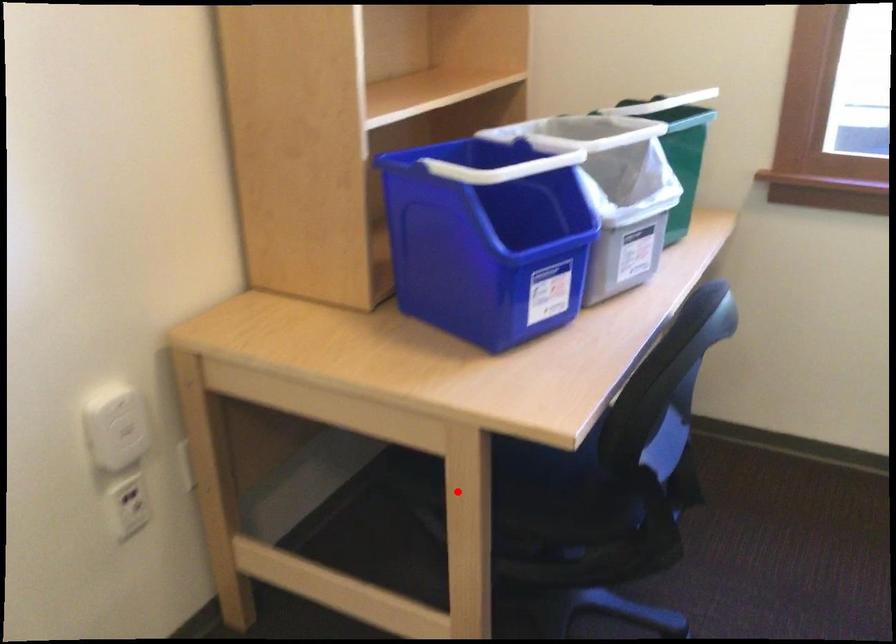
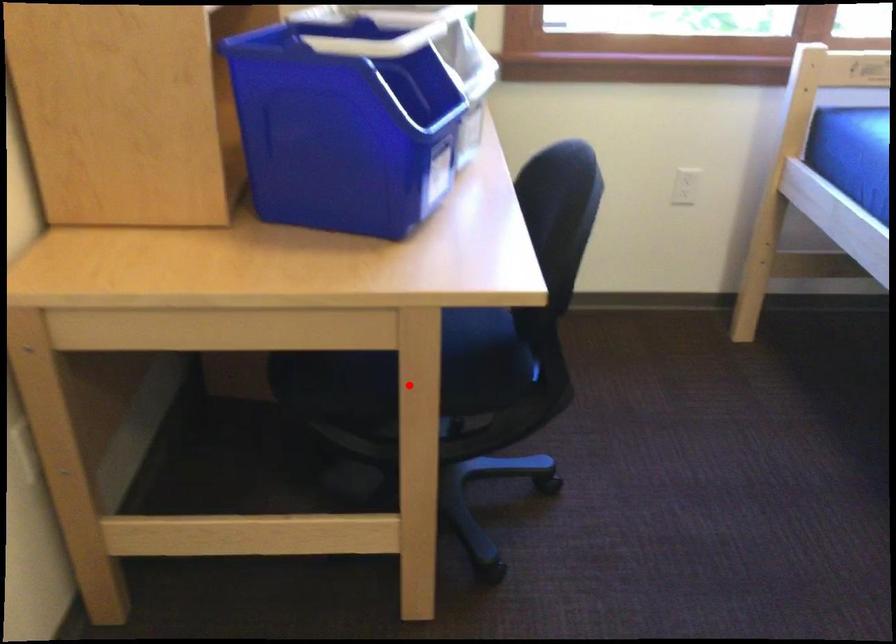
I am providing you with two images of the same scene from different viewpoints. A red point is marked on the first image and another point is marked on the second image. Do the highlighted points in image1 and image2 indicate the same real-world spot?

Yes